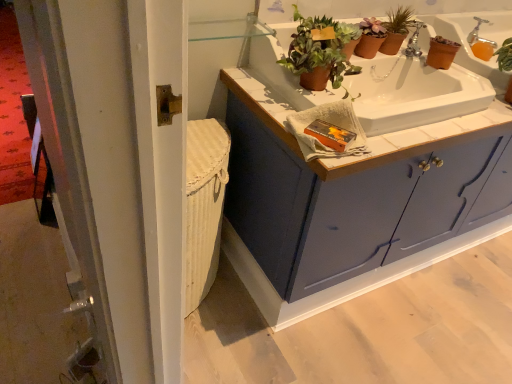
In order to face silver metallic faucet at upper right, should I rotate leftwards or rightwards?

It's best to rotate right around 28.307 degrees.

This screenshot has width=512, height=384. What do you see at coordinates (320, 51) in the screenshot?
I see `terracotta clay pot at upper center, which appears as the second houseplant when viewed from the right` at bounding box center [320, 51].

The width and height of the screenshot is (512, 384). Find the location of `white tile countertop at upper center`. white tile countertop at upper center is located at coordinates (419, 141).

From a real-world perspective, is terracotta clay pot at upper center, the second houseplant when ordered from front to back, physically above silver metallic faucet at upper right?

Yes, from a real-world perspective, terracotta clay pot at upper center, the second houseplant when ordered from front to back, is above silver metallic faucet at upper right.

Could you tell me if terracotta clay pot at upper center, the second houseplant when ordered from left to right, is facing silver metallic faucet at upper right?

No, terracotta clay pot at upper center, the second houseplant when ordered from left to right, does not turn towards silver metallic faucet at upper right.

Is terracotta clay pot at upper center, which is the 1th houseplant in right-to-left order, to the right of silver metallic faucet at upper right from the viewer's perspective?

Incorrect, terracotta clay pot at upper center, which is the 1th houseplant in right-to-left order, is not on the right side of silver metallic faucet at upper right.

Which is behind, point (401, 21) or point (473, 36)?

The point (473, 36) is farther.

Which is closer, (486,42) or (470,127)?

The point (470,127) is more forward.

Is matte blue cabinet at center a part of silver metallic faucet at upper right?

No, matte blue cabinet at center is not a part of silver metallic faucet at upper right.

Is silver metallic faucet at upper right oriented away from matte blue cabinet at center?

No, matte blue cabinet at center is not at the back of silver metallic faucet at upper right.

From a real-world perspective, is silver metallic faucet at upper right beneath matte blue cabinet at center?

No, from a real-world perspective, silver metallic faucet at upper right is not under matte blue cabinet at center.

Is matte blue cabinet at center not close to terracotta clay pot at upper center, which is the first houseplant in back-to-front order?

Actually, matte blue cabinet at center and terracotta clay pot at upper center, which is the first houseplant in back-to-front order, are a little close together.

Who is bigger, matte blue cabinet at center or terracotta clay pot at upper center, the second houseplant when ordered from front to back?

With larger size is matte blue cabinet at center.

Considering the sizes of matte blue cabinet at center and terracotta clay pot at upper center, which is the first houseplant in back-to-front order, in the image, is matte blue cabinet at center wider or thinner than terracotta clay pot at upper center, which is the first houseplant in back-to-front order,?

matte blue cabinet at center is wider than terracotta clay pot at upper center, which is the first houseplant in back-to-front order.

Is matte blue cabinet at center behind terracotta clay pot at upper center, which is the 1th houseplant in right-to-left order?

No.

Can you confirm if silver metallic faucet at upper right is shorter than terracotta clay pot at upper center, which appears as the second houseplant when viewed from the right?

Correct, silver metallic faucet at upper right is not as tall as terracotta clay pot at upper center, which appears as the second houseplant when viewed from the right.

Where is `the 2nd houseplant in front of the silver metallic faucet at upper right`? the 2nd houseplant in front of the silver metallic faucet at upper right is located at coordinates (320, 51).

From a real-world perspective, is silver metallic faucet at upper right positioned over terracotta clay pot at upper center, which appears as the first houseplant when viewed from the left, based on gravity?

Actually, silver metallic faucet at upper right is physically below terracotta clay pot at upper center, which appears as the first houseplant when viewed from the left, in the real world.

What's the angular difference between silver metallic faucet at upper right and terracotta clay pot at upper center, acting as the 2th houseplant starting from the back,'s facing directions?

43.2 degrees separate the facing orientations of silver metallic faucet at upper right and terracotta clay pot at upper center, acting as the 2th houseplant starting from the back.

Does terracotta clay pot at upper center, acting as the 2th houseplant starting from the back, have a lesser height compared to white tile countertop at upper center?

Yes, terracotta clay pot at upper center, acting as the 2th houseplant starting from the back, is shorter than white tile countertop at upper center.

From the image's perspective, relative to white tile countertop at upper center, is terracotta clay pot at upper center, which appears as the first houseplant when viewed from the left, above or below?

Clearly, from the image's perspective, terracotta clay pot at upper center, which appears as the first houseplant when viewed from the left, is above white tile countertop at upper center.

Can you tell me how much terracotta clay pot at upper center, acting as the 2th houseplant starting from the back, and white tile countertop at upper center differ in facing direction?

The angle between the facing direction of terracotta clay pot at upper center, acting as the 2th houseplant starting from the back, and the facing direction of white tile countertop at upper center is 2.27 degrees.

Is terracotta clay pot at upper center, which appears as the first houseplant when viewed from the left, completely or partially outside of white tile countertop at upper center?

No.

Is matte blue cabinet at center taller or shorter than white tile countertop at upper center?

In the image, matte blue cabinet at center appears to be taller than white tile countertop at upper center.

Which object is thinner, matte blue cabinet at center or white tile countertop at upper center?

Thinner between the two is white tile countertop at upper center.

What's the angular difference between matte blue cabinet at center and white tile countertop at upper center's facing directions?

The facing directions of matte blue cabinet at center and white tile countertop at upper center are 0.648 degrees apart.

At what (x,y) coordinates should I click in order to perform the action: click on bathroom cabinet on the right of white tile countertop at upper center. Please return your answer as a coordinate pair (x, y). Image resolution: width=512 pixels, height=384 pixels. Looking at the image, I should click on (344, 281).

From the picture: How different are the orientations of white tile countertop at upper center and terracotta clay pot at upper center, arranged as the 1th houseplant when viewed from the front, in degrees?

There is a 2.27-degree angle between the facing directions of white tile countertop at upper center and terracotta clay pot at upper center, arranged as the 1th houseplant when viewed from the front.

Considering the relative sizes of white tile countertop at upper center and terracotta clay pot at upper center, arranged as the 1th houseplant when viewed from the front, in the image provided, is white tile countertop at upper center bigger than terracotta clay pot at upper center, arranged as the 1th houseplant when viewed from the front,?

Indeed, white tile countertop at upper center has a larger size compared to terracotta clay pot at upper center, arranged as the 1th houseplant when viewed from the front.

Could you tell me if white tile countertop at upper center is turned towards terracotta clay pot at upper center, arranged as the 1th houseplant when viewed from the front?

No, white tile countertop at upper center does not turn towards terracotta clay pot at upper center, arranged as the 1th houseplant when viewed from the front.

From the image's perspective, would you say white tile countertop at upper center is shown under terracotta clay pot at upper center, acting as the 2th houseplant starting from the back?

Yes, from the image's perspective, white tile countertop at upper center is below terracotta clay pot at upper center, acting as the 2th houseplant starting from the back.

Identify the location of faucet behind the terracotta clay pot at upper center, the second houseplant when ordered from front to back. Image resolution: width=512 pixels, height=384 pixels. (478, 35).

Identify the location of bathroom cabinet in front of the silver metallic faucet at upper right. 344,281.

Considering their positions, is matte blue cabinet at center positioned closer to terracotta clay pot at upper center, which appears as the second houseplant when viewed from the right, than silver metallic faucet at upper right?

Based on the image, matte blue cabinet at center appears to be nearer to terracotta clay pot at upper center, which appears as the second houseplant when viewed from the right.

Which object lies further to the anchor point matte blue cabinet at center, white tile countertop at upper center or terracotta clay pot at upper center, which appears as the first houseplant when viewed from the left?

terracotta clay pot at upper center, which appears as the first houseplant when viewed from the left, is further to matte blue cabinet at center.

Looking at the image, which one is located further to silver metallic faucet at upper right, terracotta clay pot at upper center, the second houseplant when ordered from front to back, or white tile countertop at upper center?

white tile countertop at upper center is further to silver metallic faucet at upper right.

Looking at the image, which one is located further to matte blue cabinet at center, terracotta clay pot at upper center, which is the first houseplant in back-to-front order, or terracotta clay pot at upper center, acting as the 2th houseplant starting from the back?

terracotta clay pot at upper center, which is the first houseplant in back-to-front order, lies further to matte blue cabinet at center than the other object.

Estimate the real-world distances between objects in this image. Which object is closer to terracotta clay pot at upper center, the second houseplant when ordered from front to back, silver metallic faucet at upper right or terracotta clay pot at upper center, which appears as the first houseplant when viewed from the left?

silver metallic faucet at upper right lies closer to terracotta clay pot at upper center, the second houseplant when ordered from front to back, than the other object.

From the image, which object appears to be farther from white tile countertop at upper center, terracotta clay pot at upper center, acting as the 2th houseplant starting from the back, or terracotta clay pot at upper center, which is the 1th houseplant in right-to-left order?

terracotta clay pot at upper center, which is the 1th houseplant in right-to-left order, is further to white tile countertop at upper center.

Looking at the image, which one is located closer to terracotta clay pot at upper center, which is the first houseplant in back-to-front order, terracotta clay pot at upper center, arranged as the 1th houseplant when viewed from the front, or silver metallic faucet at upper right?

silver metallic faucet at upper right is positioned closer to the anchor terracotta clay pot at upper center, which is the first houseplant in back-to-front order.

Based on their spatial positions, is matte blue cabinet at center or terracotta clay pot at upper center, arranged as the 1th houseplant when viewed from the front, further from white tile countertop at upper center?

Based on the image, matte blue cabinet at center appears to be further to white tile countertop at upper center.

Where is `countertop located between matte blue cabinet at center and terracotta clay pot at upper center, the second houseplant when ordered from front to back, in the depth direction`? The image size is (512, 384). countertop located between matte blue cabinet at center and terracotta clay pot at upper center, the second houseplant when ordered from front to back, in the depth direction is located at coordinates (419, 141).

Find the location of a particular element. The height and width of the screenshot is (384, 512). houseplant between white tile countertop at upper center and terracotta clay pot at upper center, the second houseplant when ordered from left to right, from front to back is located at coordinates (320, 51).

I want to click on countertop located between terracotta clay pot at upper center, which appears as the second houseplant when viewed from the right, and silver metallic faucet at upper right in the left-right direction, so click(x=419, y=141).

This screenshot has width=512, height=384. In order to click on houseplant situated between terracotta clay pot at upper center, acting as the 2th houseplant starting from the back, and matte blue cabinet at center from left to right in this screenshot , I will do `click(396, 29)`.